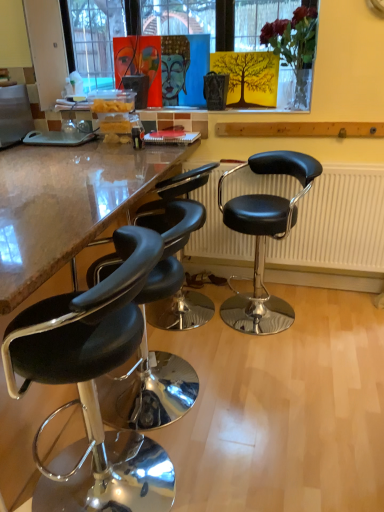
What are the coordinates of `black leather stool at right, placed as the first chair when sorted from right to left` in the screenshot? It's located at (264, 238).

What is the approximate width of black leather stool at right, placed as the first chair when sorted from right to left?

black leather stool at right, placed as the first chair when sorted from right to left, is 51.87 centimeters wide.

Identify the location of black leather stool at left, which is counted as the second chair, starting from the right. (177, 198).

In the scene shown: Measure the distance between black leather stool at left, which ranks as the 1th chair in left-to-right order, and camera.

A distance of 36.64 inches exists between black leather stool at left, which ranks as the 1th chair in left-to-right order, and camera.

This screenshot has height=512, width=384. What do you see at coordinates (92, 387) in the screenshot? I see `black leather stool at left, which ranks as the 1th chair in left-to-right order` at bounding box center [92, 387].

Image resolution: width=384 pixels, height=512 pixels. Identify the location of black leather radiator at center. (337, 224).

This screenshot has width=384, height=512. Identify the location of black leather stool at right, placed as the first chair when sorted from right to left. (264, 238).

Which chair is the 2nd one when counting from the front of the black leather radiator at center? Please provide its 2D coordinates.

[(264, 238)]

Who is shorter, black leather radiator at center or black leather stool at right, placed as the first chair when sorted from right to left?

With less height is black leather radiator at center.

Is black leather radiator at center far from black leather stool at right, placed as the first chair when sorted from right to left?

No, there isn't a large distance between black leather radiator at center and black leather stool at right, placed as the first chair when sorted from right to left.

Does black leather radiator at center appear on the left side of black leather stool at right, placed as the 4th chair when sorted from left to right?

In fact, black leather radiator at center is to the right of black leather stool at right, placed as the 4th chair when sorted from left to right.

Looking at this image, looking at their sizes, would you say black leather stool at lower left, placed as the third chair when sorted from right to left, is wider or thinner than black leather stool at left, which ranks as the 1th chair in left-to-right order?

Clearly, black leather stool at lower left, placed as the third chair when sorted from right to left, has more width compared to black leather stool at left, which ranks as the 1th chair in left-to-right order.

Considering the relative sizes of black leather stool at lower left, placed as the third chair when sorted from right to left, and black leather stool at left, which ranks as the 1th chair in left-to-right order, in the image provided, is black leather stool at lower left, placed as the third chair when sorted from right to left, shorter than black leather stool at left, which ranks as the 1th chair in left-to-right order,?

Yes, black leather stool at lower left, placed as the third chair when sorted from right to left, is shorter than black leather stool at left, which ranks as the 1th chair in left-to-right order.

Looking at the image, does black leather stool at lower left, placed as the third chair when sorted from right to left, seem bigger or smaller compared to black leather stool at left, the 4th chair positioned from the right?

black leather stool at lower left, placed as the third chair when sorted from right to left, is smaller than black leather stool at left, the 4th chair positioned from the right.

Is black leather stool at right, placed as the 4th chair when sorted from left to right, facing towards black leather radiator at center?

No, black leather stool at right, placed as the 4th chair when sorted from left to right, is not aimed at black leather radiator at center.

In the scene shown: Between black leather stool at right, placed as the first chair when sorted from right to left, and black leather radiator at center, which one has larger width?

Wider between the two is black leather stool at right, placed as the first chair when sorted from right to left.

Based on the photo, which is more to the left, black leather stool at right, placed as the 4th chair when sorted from left to right, or black leather radiator at center?

Positioned to the left is black leather stool at right, placed as the 4th chair when sorted from left to right.

Does point (293, 311) come behind point (213, 233)?

No, (293, 311) is closer to viewer.

Between black leather stool at left, which ranks as the 1th chair in left-to-right order, and black leather radiator at center, which one has smaller width?

black leather radiator at center is thinner.

Is black leather stool at left, which ranks as the 1th chair in left-to-right order, positioned beyond the bounds of black leather radiator at center?

That's correct, black leather stool at left, which ranks as the 1th chair in left-to-right order, is outside of black leather radiator at center.

From a real-world perspective, is black leather stool at left, which ranks as the 1th chair in left-to-right order, over black leather radiator at center?

Actually, black leather stool at left, which ranks as the 1th chair in left-to-right order, is physically below black leather radiator at center in the real world.

Between black leather stool at left, the 4th chair positioned from the right, and black leather radiator at center, which one has more height?

Standing taller between the two is black leather stool at left, the 4th chair positioned from the right.

Which is behind, point (308, 226) or point (168, 231)?

The point (308, 226) is behind.

This screenshot has width=384, height=512. I want to click on radiator that is on the right side of black leather stool at lower left, placed as the third chair when sorted from right to left, so click(337, 224).

In the scene shown: What's the angular difference between black leather radiator at center and black leather stool at lower left, arranged as the second chair when viewed from the left,'s facing directions?

86.6 degrees.

Is black leather radiator at center oriented away from black leather stool at lower left, placed as the third chair when sorted from right to left?

No, black leather stool at lower left, placed as the third chair when sorted from right to left, is not at the back of black leather radiator at center.

Is black leather stool at right, placed as the 4th chair when sorted from left to right, bigger or smaller than black leather stool at lower left, placed as the third chair when sorted from right to left?

Clearly, black leather stool at right, placed as the 4th chair when sorted from left to right, is larger in size than black leather stool at lower left, placed as the third chair when sorted from right to left.

Would you say black leather stool at right, placed as the 4th chair when sorted from left to right, is a long distance from black leather stool at lower left, arranged as the second chair when viewed from the left?

No, black leather stool at right, placed as the 4th chair when sorted from left to right, is in close proximity to black leather stool at lower left, arranged as the second chair when viewed from the left.

From the image's perspective, is black leather stool at right, placed as the 4th chair when sorted from left to right, on black leather stool at lower left, arranged as the second chair when viewed from the left?

Yes, from the image's perspective, black leather stool at right, placed as the 4th chair when sorted from left to right, is over black leather stool at lower left, arranged as the second chair when viewed from the left.

Is black leather stool at right, placed as the first chair when sorted from right to left, facing towards black leather stool at lower left, arranged as the second chair when viewed from the left?

No, black leather stool at right, placed as the first chair when sorted from right to left, does not turn towards black leather stool at lower left, arranged as the second chair when viewed from the left.

Is black leather radiator at center to the left of black leather stool at left, which is counted as the second chair, starting from the right, from the viewer's perspective?

No, black leather radiator at center is not to the left of black leather stool at left, which is counted as the second chair, starting from the right.

Is black leather radiator at center next to black leather stool at left, which is counted as the second chair, starting from the right?

black leather radiator at center and black leather stool at left, which is counted as the second chair, starting from the right, are not in contact.

Locate an element on the screen. Image resolution: width=384 pixels, height=512 pixels. the 2nd chair to the left of the black leather radiator at center, counting from the anchor's position is located at coordinates (177, 198).

From a real-world perspective, is black leather radiator at center below black leather stool at left, which is counted as the second chair, starting from the right?

No, from a real-world perspective, black leather radiator at center is not under black leather stool at left, which is counted as the second chair, starting from the right.

Locate an element on the screen. The width and height of the screenshot is (384, 512). radiator on the right of the black leather stool at right, placed as the 4th chair when sorted from left to right is located at coordinates pyautogui.click(x=337, y=224).

From a real-world perspective, which chair is the 3rd one above the black leather stool at lower left, arranged as the second chair when viewed from the left? Please provide its 2D coordinates.

[(92, 387)]

Which object lies nearer to the anchor point black leather stool at left, marked as the 3th chair in a left-to-right arrangement, black leather radiator at center or black leather stool at left, the 4th chair positioned from the right?

The object closer to black leather stool at left, marked as the 3th chair in a left-to-right arrangement, is black leather radiator at center.

Which object lies nearer to the anchor point black leather radiator at center, black leather stool at left, which ranks as the 1th chair in left-to-right order, or black leather stool at left, which is counted as the second chair, starting from the right?

black leather stool at left, which is counted as the second chair, starting from the right.

Considering their positions, is black leather stool at left, the 4th chair positioned from the right, positioned further to black leather stool at left, which is counted as the second chair, starting from the right, than black leather stool at right, placed as the first chair when sorted from right to left?

black leather stool at left, the 4th chair positioned from the right, lies further to black leather stool at left, which is counted as the second chair, starting from the right, than the other object.

When comparing their distances from black leather stool at lower left, placed as the third chair when sorted from right to left, does black leather radiator at center or black leather stool at left, which is counted as the second chair, starting from the right, seem closer?

black leather stool at left, which is counted as the second chair, starting from the right.

From the picture: Which object lies nearer to the anchor point black leather stool at left, marked as the 3th chair in a left-to-right arrangement, black leather stool at right, placed as the first chair when sorted from right to left, or black leather stool at lower left, arranged as the second chair when viewed from the left?

black leather stool at lower left, arranged as the second chair when viewed from the left, is closer to black leather stool at left, marked as the 3th chair in a left-to-right arrangement.

When comparing their distances from black leather stool at left, which ranks as the 1th chair in left-to-right order, does black leather stool at right, placed as the 4th chair when sorted from left to right, or black leather stool at lower left, arranged as the second chair when viewed from the left, seem closer?

black leather stool at lower left, arranged as the second chair when viewed from the left, lies closer to black leather stool at left, which ranks as the 1th chair in left-to-right order, than the other object.

When comparing their distances from black leather stool at left, the 4th chair positioned from the right, does black leather stool at left, marked as the 3th chair in a left-to-right arrangement, or black leather stool at right, placed as the 4th chair when sorted from left to right, seem further?

black leather stool at right, placed as the 4th chair when sorted from left to right, is positioned further to the anchor black leather stool at left, the 4th chair positioned from the right.

Which object lies further to the anchor point black leather stool at lower left, placed as the third chair when sorted from right to left, black leather radiator at center or black leather stool at left, the 4th chair positioned from the right?

Based on the image, black leather radiator at center appears to be further to black leather stool at lower left, placed as the third chair when sorted from right to left.

Identify the location of chair located between black leather stool at left, which is counted as the second chair, starting from the right, and black leather radiator at center in the left-right direction. Image resolution: width=384 pixels, height=512 pixels. (264, 238).

Find the location of a particular element. This screenshot has height=512, width=384. chair between black leather stool at left, which ranks as the 1th chair in left-to-right order, and black leather stool at right, placed as the 4th chair when sorted from left to right, in the front-back direction is located at coordinates (146, 333).

This screenshot has width=384, height=512. Find the location of `chair between black leather stool at lower left, placed as the third chair when sorted from right to left, and black leather stool at right, placed as the first chair when sorted from right to left`. chair between black leather stool at lower left, placed as the third chair when sorted from right to left, and black leather stool at right, placed as the first chair when sorted from right to left is located at coordinates (177, 198).